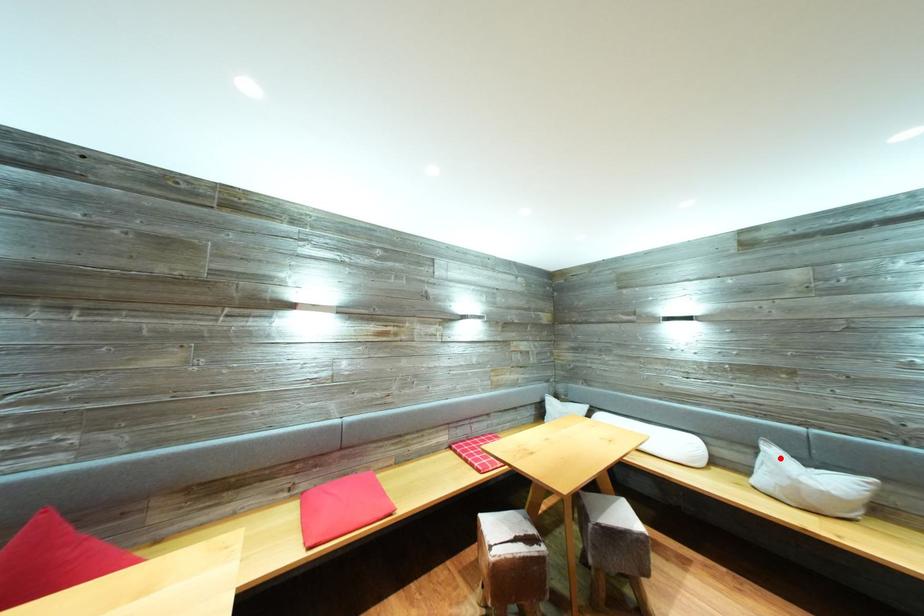
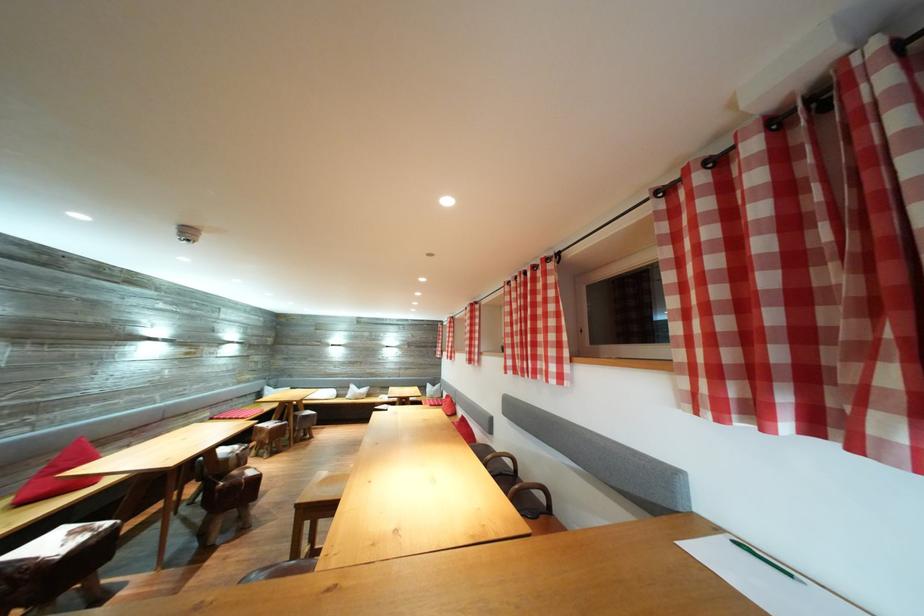
Find the pixel in the second image that matches the highlighted location in the first image.

(359, 392)